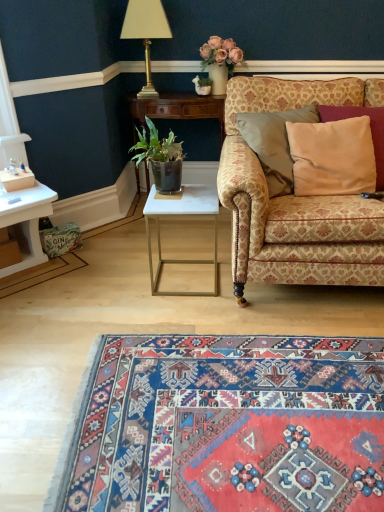
Question: Is there a large distance between carpet with intricate patterns at lower center and gold metallic lamp at upper center?

Choices:
 (A) yes
 (B) no

Answer: (A)

Question: Is carpet with intricate patterns at lower center facing towards gold metallic lamp at upper center?

Choices:
 (A) yes
 (B) no

Answer: (B)

Question: Does carpet with intricate patterns at lower center have a smaller size compared to gold metallic lamp at upper center?

Choices:
 (A) no
 (B) yes

Answer: (A)

Question: Is carpet with intricate patterns at lower center located outside gold metallic lamp at upper center?

Choices:
 (A) no
 (B) yes

Answer: (B)

Question: Does carpet with intricate patterns at lower center appear on the left side of gold metallic lamp at upper center?

Choices:
 (A) no
 (B) yes

Answer: (A)

Question: Can you confirm if carpet with intricate patterns at lower center is thinner than gold metallic lamp at upper center?

Choices:
 (A) yes
 (B) no

Answer: (B)

Question: Would you say white glossy side table at center, which ranks as the 1th table in back-to-front order, is outside white marble table at center, which is the second table in top-to-bottom order?

Choices:
 (A) no
 (B) yes

Answer: (B)

Question: Is white glossy side table at center, which ranks as the 1th table in back-to-front order, positioned with its back to white marble table at center, which is the second table from back to front?

Choices:
 (A) no
 (B) yes

Answer: (A)

Question: From the image's perspective, is white glossy side table at center, which ranks as the 1th table in back-to-front order, located beneath white marble table at center, which is the second table from back to front?

Choices:
 (A) no
 (B) yes

Answer: (A)

Question: From the image's perspective, is white glossy side table at center, the 1th table when ordered from top to bottom, located above white marble table at center, which is the second table in top-to-bottom order?

Choices:
 (A) yes
 (B) no

Answer: (A)

Question: From a real-world perspective, is white glossy side table at center, acting as the second table starting from the bottom, on white marble table at center, which is the second table from back to front?

Choices:
 (A) no
 (B) yes

Answer: (B)

Question: Does white glossy side table at center, the second table from the front, have a lesser height compared to white marble table at center, the 1th table viewed from the front?

Choices:
 (A) no
 (B) yes

Answer: (A)

Question: Can you confirm if patterned fabric couch at right is taller than green leafy plant in dark pot at center?

Choices:
 (A) no
 (B) yes

Answer: (B)